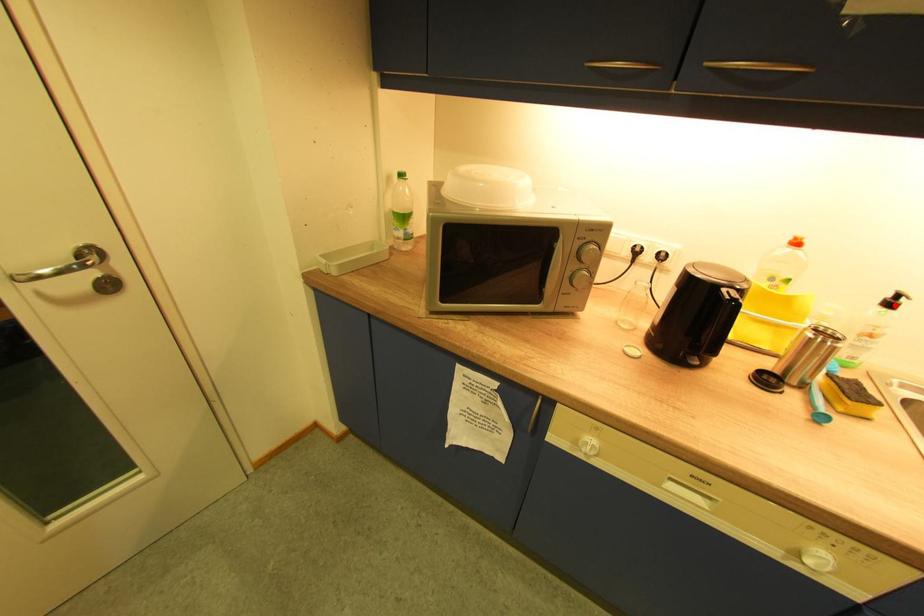
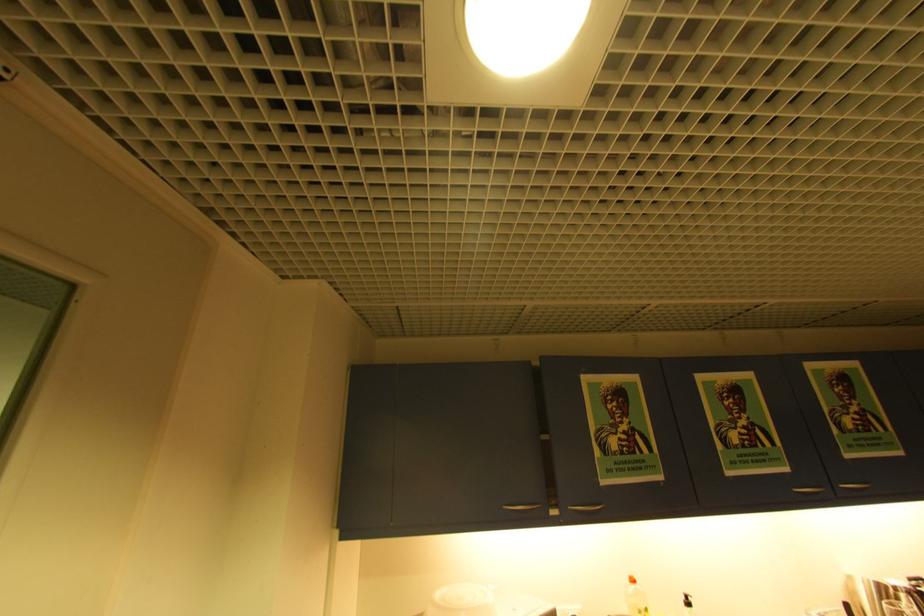
Question: I am providing you with two images of the same scene from different viewpoints. A red point is marked on the first image. Can you still see the location of the red point in image 2?

Choices:
 (A) Yes
 (B) No

Answer: (A)